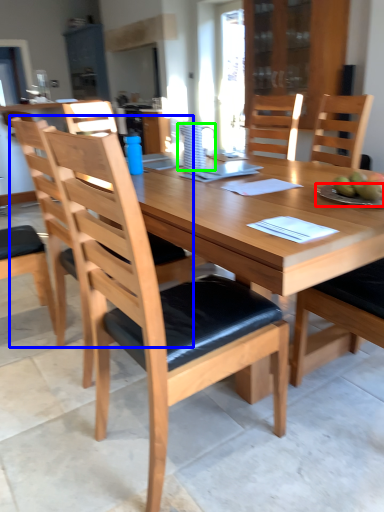
Question: Which object is the closest to the plate (highlighted by a red box)? Choose among these: chair (highlighted by a blue box) or pitcher (highlighted by a green box).

Choices:
 (A) chair
 (B) pitcher

Answer: (B)